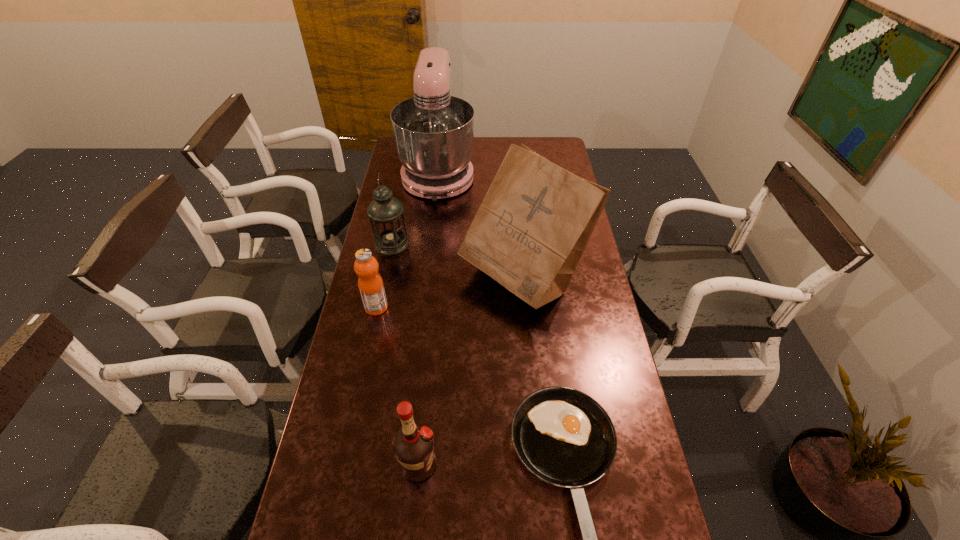
What are the coordinates of `the farthest object` in the screenshot? It's located at (434, 132).

Image resolution: width=960 pixels, height=540 pixels. In order to click on grocery bag in this screenshot , I will do `click(533, 225)`.

You are a GUI agent. You are given a task and a screenshot of the screen. Output one action in this format:
    pyautogui.click(x=<x>, y=<y>)
    Task: Click on the oil lamp
    The image size is (960, 540).
    Given the screenshot: What is the action you would take?
    pyautogui.click(x=386, y=213)

At what (x,y) coordinates should I click in order to perform the action: click on liquor. Please return your answer as a coordinate pair (x, y). Looking at the image, I should click on (413, 444).

Locate an element on the screen. fruit juice is located at coordinates (371, 287).

This screenshot has height=540, width=960. I want to click on blank area located on the front-facing side of the farthest object, so click(427, 268).

The height and width of the screenshot is (540, 960). Find the location of `vacant space situated on the front of the grocery bag`. vacant space situated on the front of the grocery bag is located at coordinates (530, 350).

Image resolution: width=960 pixels, height=540 pixels. I want to click on free spot located 0.370m on the front of the oil lamp, so click(x=373, y=335).

At what (x,y) coordinates should I click in order to perform the action: click on vacant area situated 0.250m on the front and back of the liquor. Please return your answer as a coordinate pair (x, y). Looking at the image, I should click on (535, 464).

Where is `blank space located 0.190m on the front of the second shortest object`? blank space located 0.190m on the front of the second shortest object is located at coordinates (364, 365).